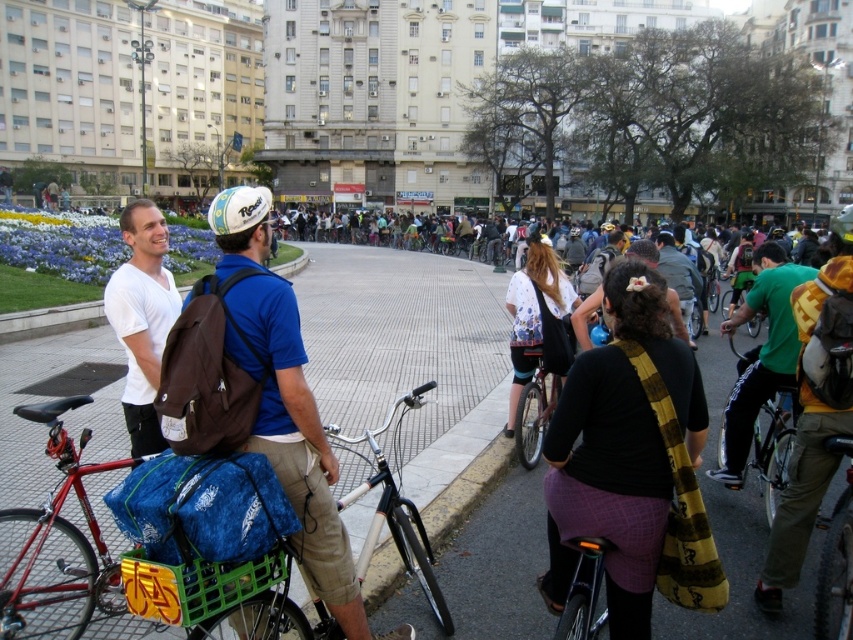
Is brown fabric backpack at center behind silver metallic bicycle at center?

Yes, it is.

Is brown fabric backpack at center closer to the viewer compared to silver metallic bicycle at center?

No, brown fabric backpack at center is behind silver metallic bicycle at center.

Is point (344, 545) behind point (372, 541)?

No, it is in front of (372, 541).

Where is `brown fabric backpack at center`? This screenshot has height=640, width=853. brown fabric backpack at center is located at coordinates [296, 442].

Does white matte bicycle helmet at upper center appear on the right side of dark gray backpack at center?

In fact, white matte bicycle helmet at upper center is to the left of dark gray backpack at center.

Is white matte bicycle helmet at upper center taller than dark gray backpack at center?

In fact, white matte bicycle helmet at upper center may be shorter than dark gray backpack at center.

Is point (257, 218) positioned before point (693, 273)?

Yes, point (257, 218) is in front of point (693, 273).

The image size is (853, 640). Identify the location of white matte bicycle helmet at upper center. (238, 209).

Which of these two, green fabric backpack at right or dark gray backpack at center, stands shorter?

With less height is dark gray backpack at center.

Does green fabric backpack at right have a lesser height compared to dark gray backpack at center?

No, green fabric backpack at right is not shorter than dark gray backpack at center.

Image resolution: width=853 pixels, height=640 pixels. I want to click on green fabric backpack at right, so click(x=761, y=355).